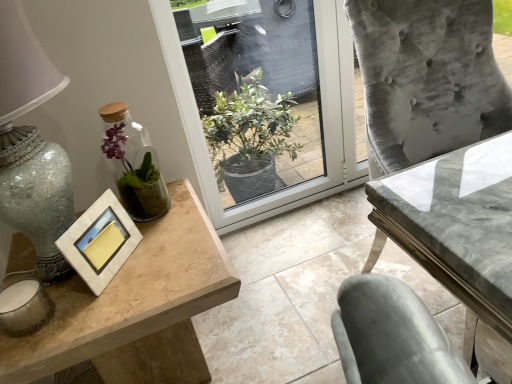
Find the location of a particular element. matte silver picture frame at left is located at coordinates (100, 241).

What do you see at coordinates (133, 165) in the screenshot?
I see `clear glass vase at left` at bounding box center [133, 165].

The width and height of the screenshot is (512, 384). What do you see at coordinates (459, 239) in the screenshot? I see `marble gray table at center, which ranks as the first table in right-to-left order` at bounding box center [459, 239].

This screenshot has width=512, height=384. What do you see at coordinates (136, 307) in the screenshot?
I see `wooden table at left, which is the 1th table in left-to-right order` at bounding box center [136, 307].

How much space does wooden table at left, marked as the second table in a right-to-left arrangement, occupy horizontally?

wooden table at left, marked as the second table in a right-to-left arrangement, is 23.95 inches wide.

Locate an element on the screen. This screenshot has height=384, width=512. matte silver picture frame at left is located at coordinates (100, 241).

From the image's perspective, is wooden table at left, which is the 1th table in left-to-right order, over marble gray table at center, which is the second table in left-to-right order?

Incorrect, from the image's perspective, wooden table at left, which is the 1th table in left-to-right order, is lower than marble gray table at center, which is the second table in left-to-right order.

Identify the location of table on the right of the wooden table at left, marked as the second table in a right-to-left arrangement. Image resolution: width=512 pixels, height=384 pixels. (459, 239).

From a real-world perspective, who is located lower, wooden table at left, which is the 1th table in left-to-right order, or marble gray table at center, which ranks as the first table in right-to-left order?

In real-world perspective, wooden table at left, which is the 1th table in left-to-right order, is lower.

Which object is thinner, marble gray table at center, which ranks as the first table in right-to-left order, or clear glass vase at left?

clear glass vase at left is thinner.

Looking at this image, who is taller, marble gray table at center, which is the second table in left-to-right order, or clear glass vase at left?

marble gray table at center, which is the second table in left-to-right order.

Considering the positions of objects marble gray table at center, which ranks as the first table in right-to-left order, and clear glass vase at left in the image provided, who is more to the right, marble gray table at center, which ranks as the first table in right-to-left order, or clear glass vase at left?

marble gray table at center, which ranks as the first table in right-to-left order.

From a real-world perspective, is transparent glass window at center physically above marble gray table at center, which ranks as the first table in right-to-left order?

Yes, from a real-world perspective, transparent glass window at center is above marble gray table at center, which ranks as the first table in right-to-left order.

Which is in front, transparent glass window at center or marble gray table at center, which is the second table in left-to-right order?

marble gray table at center, which is the second table in left-to-right order, is more forward.

Which object is positioned more to the right, transparent glass window at center or marble gray table at center, which ranks as the first table in right-to-left order?

Positioned to the right is marble gray table at center, which ranks as the first table in right-to-left order.

How many degrees apart are the facing directions of transparent glass window at center and marble gray table at center, which ranks as the first table in right-to-left order?

transparent glass window at center and marble gray table at center, which ranks as the first table in right-to-left order, are facing 0.00198 degrees away from each other.

Would you say matte silver picture frame at left is outside clear glass vase at left?

matte silver picture frame at left lies outside clear glass vase at left's area.

Is clear glass vase at left at the back of matte silver picture frame at left?

No.

From a real-world perspective, which object rests below the other?

From a 3D spatial view, matte silver picture frame at left is below.

Considering the relative positions of matte silver picture frame at left and clear glass vase at left in the image provided, is matte silver picture frame at left to the right of clear glass vase at left from the viewer's perspective?

Incorrect, matte silver picture frame at left is not on the right side of clear glass vase at left.

From a real-world perspective, is matte silver picture frame at left physically located above or below marble gray table at center, which ranks as the first table in right-to-left order?

matte silver picture frame at left is above marble gray table at center, which ranks as the first table in right-to-left order.

Based on the photo, is matte silver picture frame at left beside marble gray table at center, which ranks as the first table in right-to-left order?

No, matte silver picture frame at left is not making contact with marble gray table at center, which ranks as the first table in right-to-left order.

Which of these two, matte silver picture frame at left or marble gray table at center, which ranks as the first table in right-to-left order, is bigger?

With larger size is marble gray table at center, which ranks as the first table in right-to-left order.

In the scene shown: Between matte silver picture frame at left and marble gray table at center, which ranks as the first table in right-to-left order, which one appears on the right side from the viewer's perspective?

From the viewer's perspective, marble gray table at center, which ranks as the first table in right-to-left order, appears more on the right side.

Consider the image. From a real-world perspective, which is physically above, wooden table at left, marked as the second table in a right-to-left arrangement, or clear glass vase at left?

clear glass vase at left.

Can you confirm if wooden table at left, which is the 1th table in left-to-right order, is wider than clear glass vase at left?

Correct, the width of wooden table at left, which is the 1th table in left-to-right order, exceeds that of clear glass vase at left.

Considering the positions of points (129, 309) and (159, 196), is point (129, 309) farther from camera compared to point (159, 196)?

That is False.

From the image's perspective, which is below, wooden table at left, marked as the second table in a right-to-left arrangement, or clear glass vase at left?

wooden table at left, marked as the second table in a right-to-left arrangement.

Would you say wooden table at left, marked as the second table in a right-to-left arrangement, is inside or outside transparent glass window at center?

wooden table at left, marked as the second table in a right-to-left arrangement, is not inside transparent glass window at center, it's outside.

The image size is (512, 384). I want to click on table to the left of transparent glass window at center, so click(x=136, y=307).

How many degrees apart are the facing directions of wooden table at left, marked as the second table in a right-to-left arrangement, and transparent glass window at center?

90 degrees.

Is point (122, 303) positioned behind point (174, 51)?

No.

Find the location of `table located below the marble gray table at center, which ranks as the first table in right-to-left order (from the image's perspective)`. table located below the marble gray table at center, which ranks as the first table in right-to-left order (from the image's perspective) is located at coordinates 136,307.

Locate an element on the screen. The height and width of the screenshot is (384, 512). glass vase that is above the marble gray table at center, which is the second table in left-to-right order (from a real-world perspective) is located at coordinates (133, 165).

Looking at the image, which one is located further to transparent glass window at center, matte silver picture frame at left or clear glass vase at left?

matte silver picture frame at left.

Considering their positions, is transparent glass window at center positioned closer to wooden table at left, marked as the second table in a right-to-left arrangement, than matte silver picture frame at left?

Among the two, matte silver picture frame at left is located nearer to wooden table at left, marked as the second table in a right-to-left arrangement.

Considering their positions, is matte silver picture frame at left positioned closer to clear glass vase at left than transparent glass window at center?

The object closer to clear glass vase at left is matte silver picture frame at left.

When comparing their distances from marble gray table at center, which ranks as the first table in right-to-left order, does wooden table at left, marked as the second table in a right-to-left arrangement, or transparent glass window at center seem closer?

wooden table at left, marked as the second table in a right-to-left arrangement.

Estimate the real-world distances between objects in this image. Which object is closer to transparent glass window at center, clear glass vase at left or marble gray table at center, which ranks as the first table in right-to-left order?

clear glass vase at left is positioned closer to the anchor transparent glass window at center.

When comparing their distances from matte silver picture frame at left, does transparent glass window at center or marble gray table at center, which ranks as the first table in right-to-left order, seem closer?

Among the two, marble gray table at center, which ranks as the first table in right-to-left order, is located nearer to matte silver picture frame at left.

Based on their spatial positions, is marble gray table at center, which is the second table in left-to-right order, or transparent glass window at center closer to matte silver picture frame at left?

Based on the image, marble gray table at center, which is the second table in left-to-right order, appears to be nearer to matte silver picture frame at left.

Estimate the real-world distances between objects in this image. Which object is closer to transparent glass window at center, matte silver picture frame at left or wooden table at left, marked as the second table in a right-to-left arrangement?

wooden table at left, marked as the second table in a right-to-left arrangement, lies closer to transparent glass window at center than the other object.

Identify the location of glass vase that lies between transparent glass window at center and wooden table at left, which is the 1th table in left-to-right order, from top to bottom. The width and height of the screenshot is (512, 384). (133, 165).

Locate an element on the screen. This screenshot has height=384, width=512. window between matte silver picture frame at left and marble gray table at center, which ranks as the first table in right-to-left order is located at coordinates (320, 113).

I want to click on glass vase situated between matte silver picture frame at left and transparent glass window at center from left to right, so click(133, 165).

At what (x,y) coordinates should I click in order to perform the action: click on glass vase between matte silver picture frame at left and marble gray table at center, which is the second table in left-to-right order, in the horizontal direction. Please return your answer as a coordinate pair (x, y). This screenshot has height=384, width=512. Looking at the image, I should click on (133, 165).